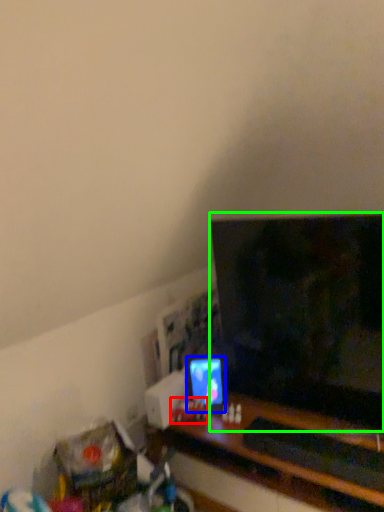
Question: Based on their relative distances, which object is farther from toy (highlighted by a red box)? Choose from computer monitor (highlighted by a blue box) and television (highlighted by a green box).

Choices:
 (A) computer monitor
 (B) television

Answer: (B)